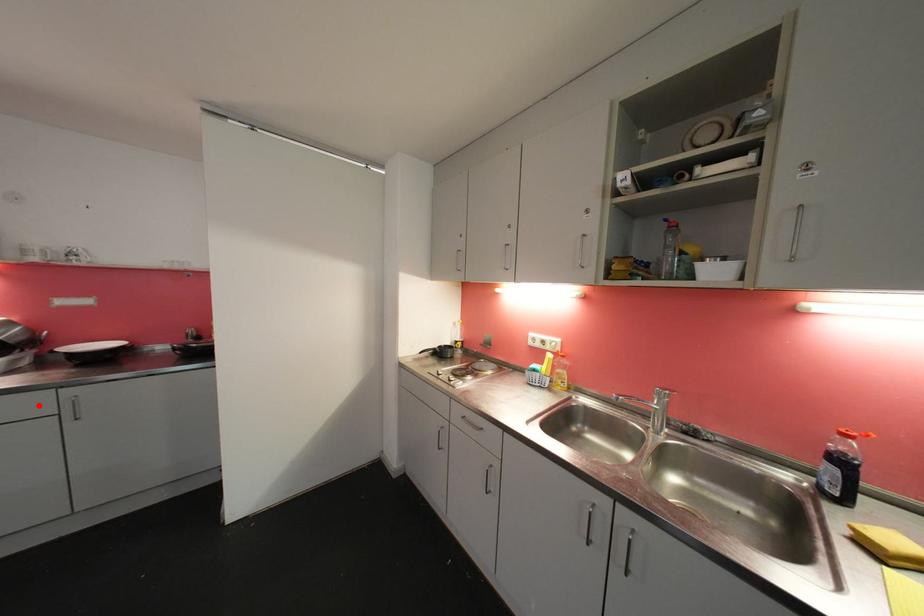
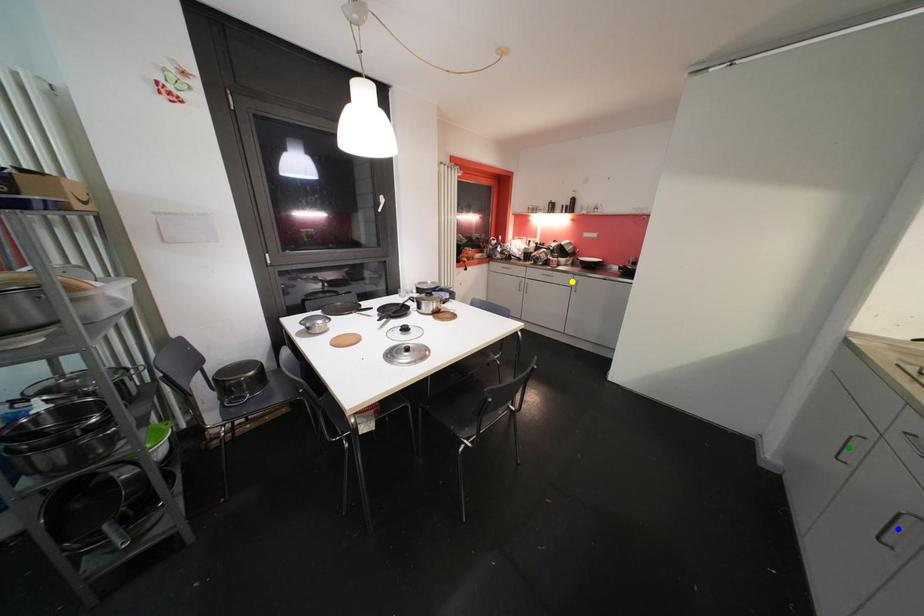
Question: I am providing you with two images of the same scene from different viewpoints. A red point is marked on the first image. You are given multiple points on the second image. Which mark in image 2 goes with the point in image 1?

Choices:
 (A) yellow point
 (B) blue point
 (C) green point

Answer: (A)